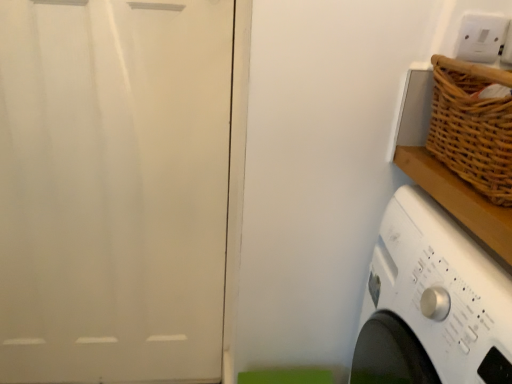
Question: Does white plastic electric outlet at upper right have a greater height compared to woven brown basket at upper right?

Choices:
 (A) yes
 (B) no

Answer: (B)

Question: Considering the relative sizes of white plastic electric outlet at upper right and woven brown basket at upper right in the image provided, is white plastic electric outlet at upper right smaller than woven brown basket at upper right?

Choices:
 (A) no
 (B) yes

Answer: (B)

Question: Is the depth of white plastic electric outlet at upper right greater than that of woven brown basket at upper right?

Choices:
 (A) no
 (B) yes

Answer: (B)

Question: Can you confirm if white plastic electric outlet at upper right is bigger than woven brown basket at upper right?

Choices:
 (A) yes
 (B) no

Answer: (B)

Question: Is the position of white plastic electric outlet at upper right less distant than that of woven brown basket at upper right?

Choices:
 (A) yes
 (B) no

Answer: (B)

Question: From the image's perspective, is white plastic electric outlet at upper right on woven brown basket at upper right?

Choices:
 (A) yes
 (B) no

Answer: (A)

Question: Would you consider white plastic electric outlet at upper right to be distant from white glossy screen door at left?

Choices:
 (A) yes
 (B) no

Answer: (B)

Question: Is white plastic electric outlet at upper right facing away from white glossy screen door at left?

Choices:
 (A) no
 (B) yes

Answer: (A)

Question: Is white plastic electric outlet at upper right closer to the viewer compared to white glossy screen door at left?

Choices:
 (A) no
 (B) yes

Answer: (B)

Question: From a real-world perspective, is white plastic electric outlet at upper right located beneath white glossy screen door at left?

Choices:
 (A) yes
 (B) no

Answer: (B)

Question: Is white plastic electric outlet at upper right smaller than white glossy screen door at left?

Choices:
 (A) no
 (B) yes

Answer: (B)

Question: Is white plastic electric outlet at upper right aimed at white glossy screen door at left?

Choices:
 (A) yes
 (B) no

Answer: (B)

Question: From the image's perspective, is white glossy screen door at left located above woven brown basket at upper right?

Choices:
 (A) yes
 (B) no

Answer: (B)